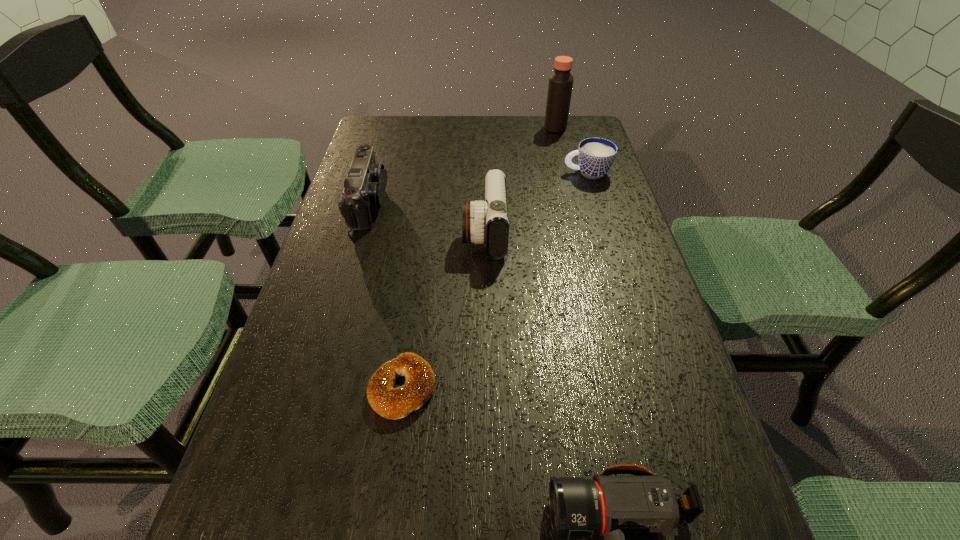
Find the location of a particular element. The image size is (960, 540). the farthest object is located at coordinates (560, 86).

Locate an element on the screen. the tallest object is located at coordinates (560, 86).

Locate an element on the screen. This screenshot has width=960, height=540. the third object from left to right is located at coordinates (487, 221).

Where is `the leftmost camcorder`? the leftmost camcorder is located at coordinates (364, 187).

Identify the location of cup. (595, 155).

Find the location of a particular element. The width and height of the screenshot is (960, 540). bagel is located at coordinates (392, 403).

Where is `the shortest object`? This screenshot has height=540, width=960. the shortest object is located at coordinates (392, 403).

Locate an element on the screen. vacant space located 0.280m on the left of the vinegar is located at coordinates (460, 128).

Where is `blank area located on the surface of the second camcorder from right to left`? The image size is (960, 540). blank area located on the surface of the second camcorder from right to left is located at coordinates (436, 232).

The image size is (960, 540). Find the location of `vacant space located on the surface of the second camcorder from right to left`. vacant space located on the surface of the second camcorder from right to left is located at coordinates (327, 232).